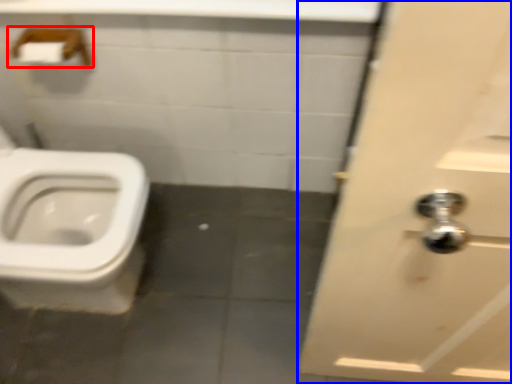
Question: Which object is further to the camera taking this photo, towel bar (highlighted by a red box) or door (highlighted by a blue box)?

Choices:
 (A) towel bar
 (B) door

Answer: (A)